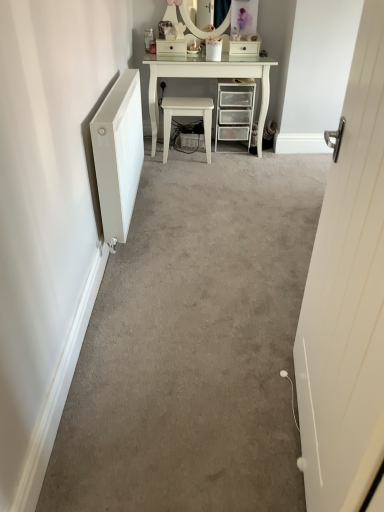
The width and height of the screenshot is (384, 512). I want to click on empty space that is ontop of white glossy drawer at upper center, the 2th drawer viewed from the left (from a real-world perspective), so click(x=241, y=39).